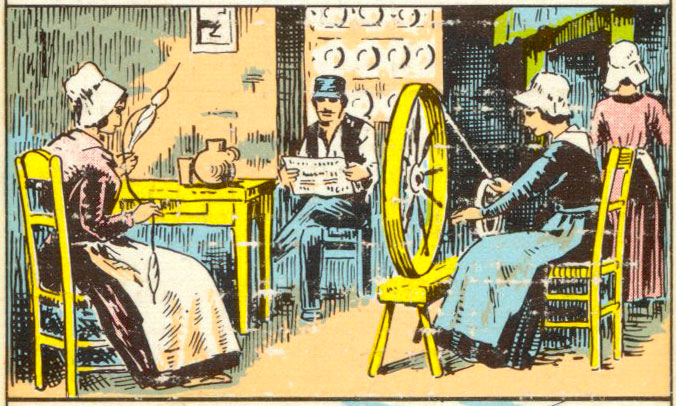
Find the location of a particular element. The height and width of the screenshot is (406, 676). table is located at coordinates (243, 192).